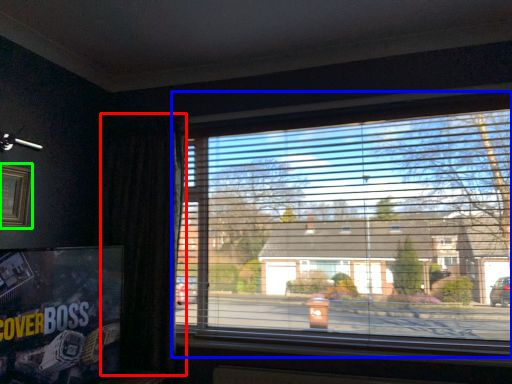
Question: Which object is the farthest from curtain (highlighted by a red box)? Choose among these: window (highlighted by a blue box) or picture frame (highlighted by a green box).

Choices:
 (A) window
 (B) picture frame

Answer: (A)